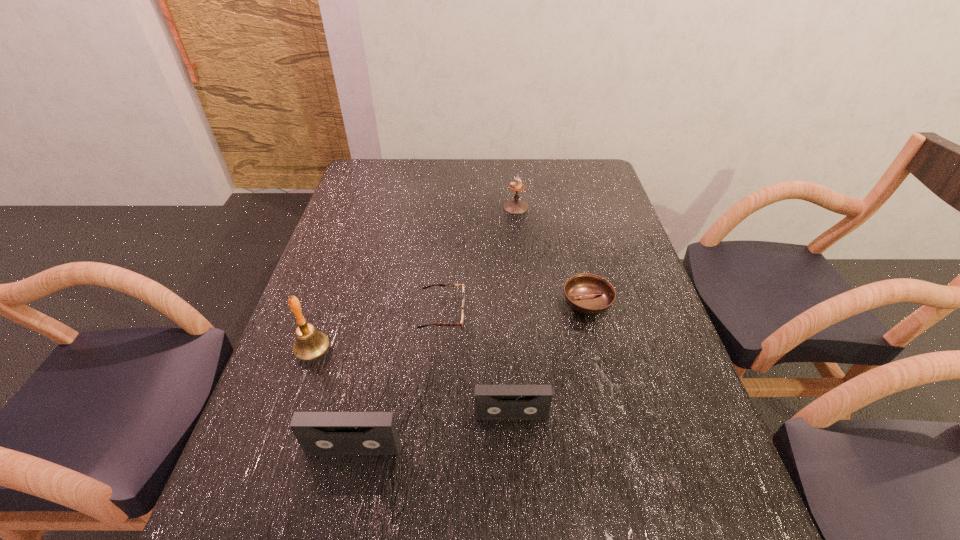
You are a GUI agent. You are given a task and a screenshot of the screen. Output one action in this format:
    pyautogui.click(x=<x>, y=<y>)
    Task: Click on the free space between the farther videotape and the second object from left to right
    This screenshot has height=540, width=960.
    Given the screenshot: What is the action you would take?
    pyautogui.click(x=432, y=431)

Locate an element on the screen. The width and height of the screenshot is (960, 540). free space between the soup bowl and the bell is located at coordinates (450, 327).

The image size is (960, 540). Find the location of `empty location between the third nearest object and the rightmost object`. empty location between the third nearest object and the rightmost object is located at coordinates (450, 327).

Where is `free spot between the shorter videotape and the fourth shortest object`? This screenshot has height=540, width=960. free spot between the shorter videotape and the fourth shortest object is located at coordinates (432, 431).

Where is `free space between the fifth farthest object and the candle holder`? free space between the fifth farthest object and the candle holder is located at coordinates (514, 311).

Where is `vacant space that's between the rightmost object and the spectacles`? vacant space that's between the rightmost object and the spectacles is located at coordinates (515, 308).

Find the location of a particular element. The width and height of the screenshot is (960, 540). free spot between the bell and the fifth shortest object is located at coordinates (415, 279).

Locate which object ranks in proximity to the spectacles. Please provide its 2D coordinates. Your answer should be formatted as a tuple, i.e. [(x, y)], where the tuple contains the x and y coordinates of a point satisfying the conditions above.

[(310, 343)]

Identify which object is the fifth closest to the rightmost object. Please provide its 2D coordinates. Your answer should be formatted as a tuple, i.e. [(x, y)], where the tuple contains the x and y coordinates of a point satisfying the conditions above.

[(310, 343)]

Where is `blank space that satisfies the following two spatial constraints: 1. on the front side of the rightmost object; 2. on the frame of the spectacles`? blank space that satisfies the following two spatial constraints: 1. on the front side of the rightmost object; 2. on the frame of the spectacles is located at coordinates (589, 314).